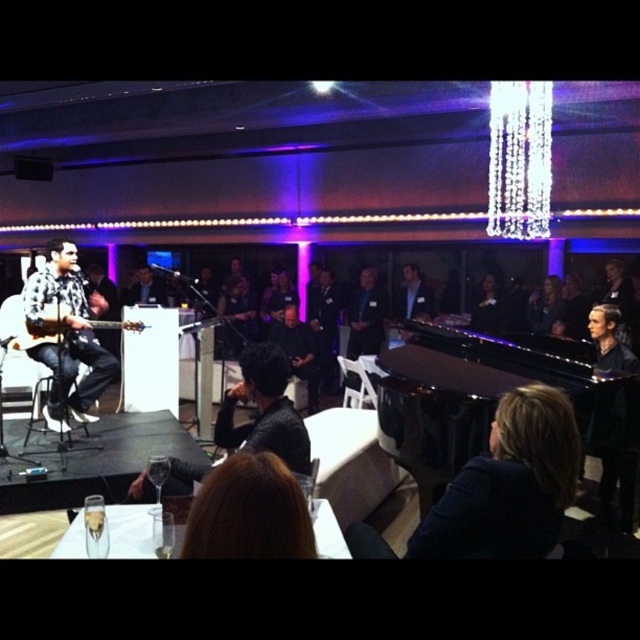
Can you confirm if matte black guitar at left is positioned below smooth black hair at upper right?

Correct, matte black guitar at left is located below smooth black hair at upper right.

Who is shorter, matte black guitar at left or smooth black hair at upper right?

matte black guitar at left is shorter.

Between point (51, 337) and point (529, 307), which one is positioned behind?

The point (529, 307) is more distant.

Find the location of a particular element. Image resolution: width=640 pixels, height=640 pixels. matte black guitar at left is located at coordinates (38, 332).

Is plaid shirt at left bigger than smooth black hair at upper right?

Correct, plaid shirt at left is larger in size than smooth black hair at upper right.

Is plaid shirt at left above smooth black hair at upper right?

No.

You are a GUI agent. You are given a task and a screenshot of the screen. Output one action in this format:
    pyautogui.click(x=<x>, y=<y>)
    Task: Click on the plaid shirt at left
    Image resolution: width=640 pixels, height=640 pixels.
    Given the screenshot: What is the action you would take?
    pyautogui.click(x=67, y=336)

Looking at this image, who is higher up, dark blue fabric at lower right or plaid shirt at left?

Positioned higher is plaid shirt at left.

Measure the distance between point (x=534, y=520) and camera.

Point (x=534, y=520) is 5.43 feet from camera.

Where is `dark blue fabric at lower right`? Image resolution: width=640 pixels, height=640 pixels. dark blue fabric at lower right is located at coordinates (509, 484).